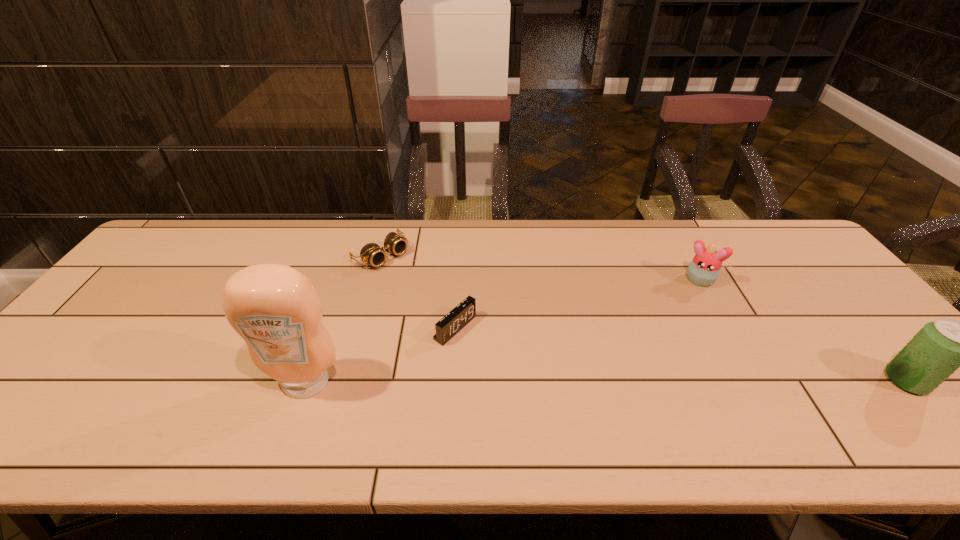
Locate an element on the screen. free location that satisfies the following two spatial constraints: 1. on the front side of the rightmost object; 2. on the left side of the second object from right to left is located at coordinates (754, 381).